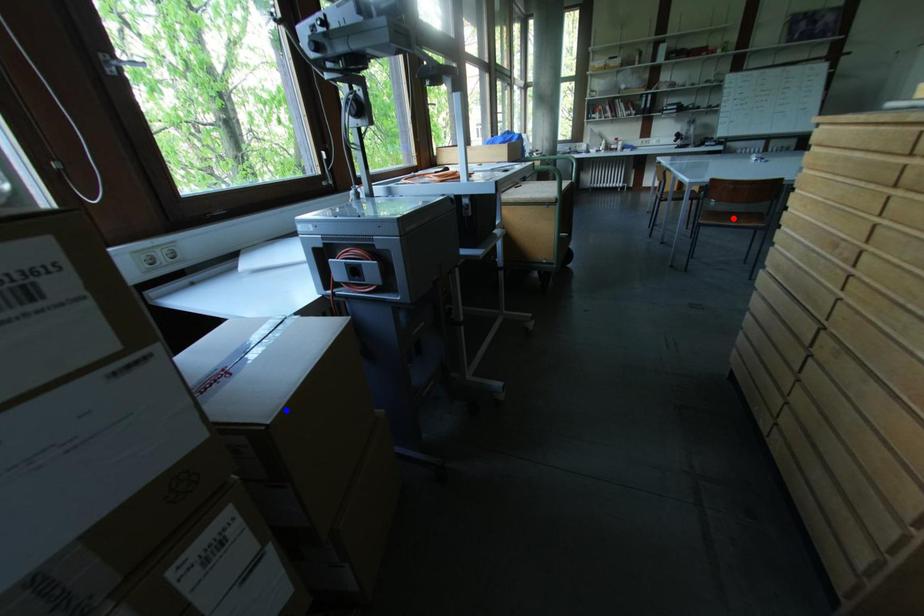
Question: Which of the two points in the image is closer to the camera?

Choices:
 (A) Blue point is closer.
 (B) Red point is closer.

Answer: (A)